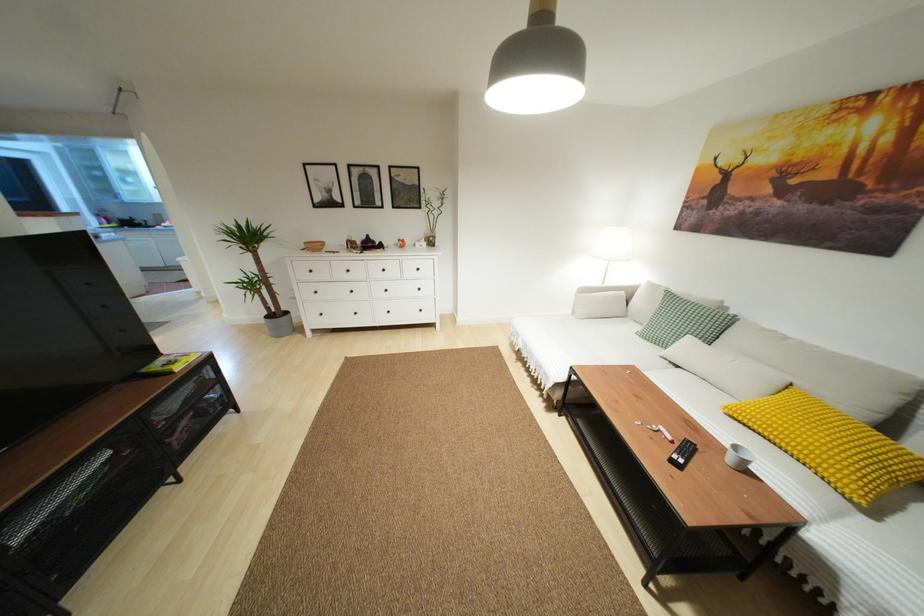
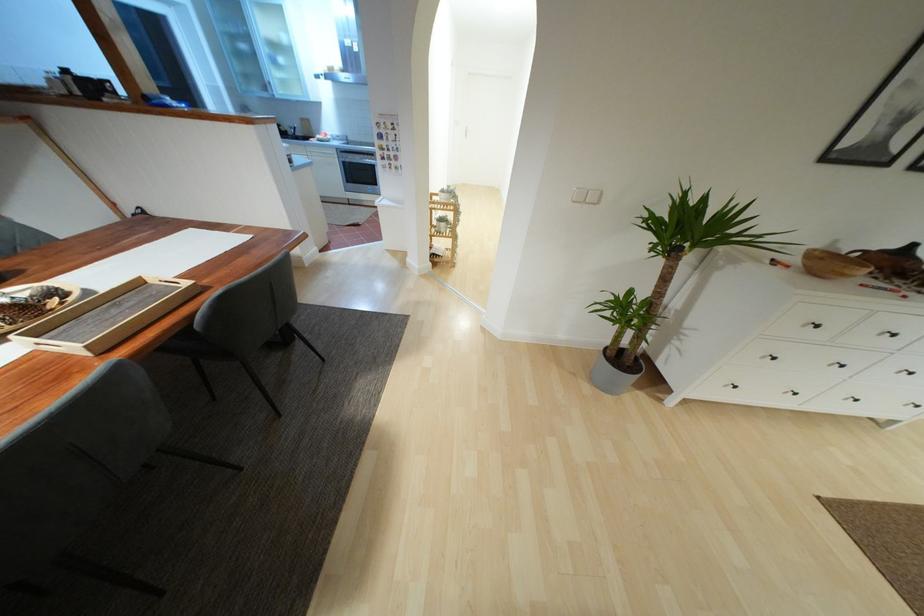
Find the pixel in the second image that matches (321,314) in the first image.

(735, 387)